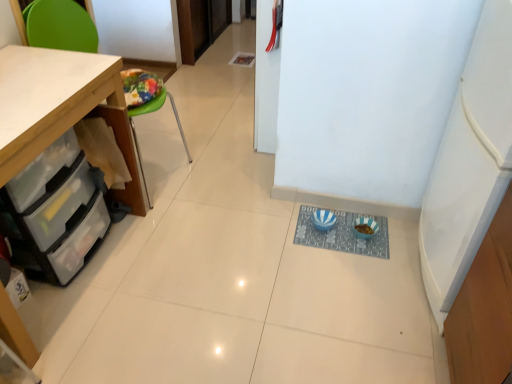
At what (x,y) coordinates should I click in order to perform the action: click on vacant location below blue striped bowls at center (from a real-world perspective). Please return your answer as a coordinate pair (x, y). The image size is (512, 384). Looking at the image, I should click on (336, 237).